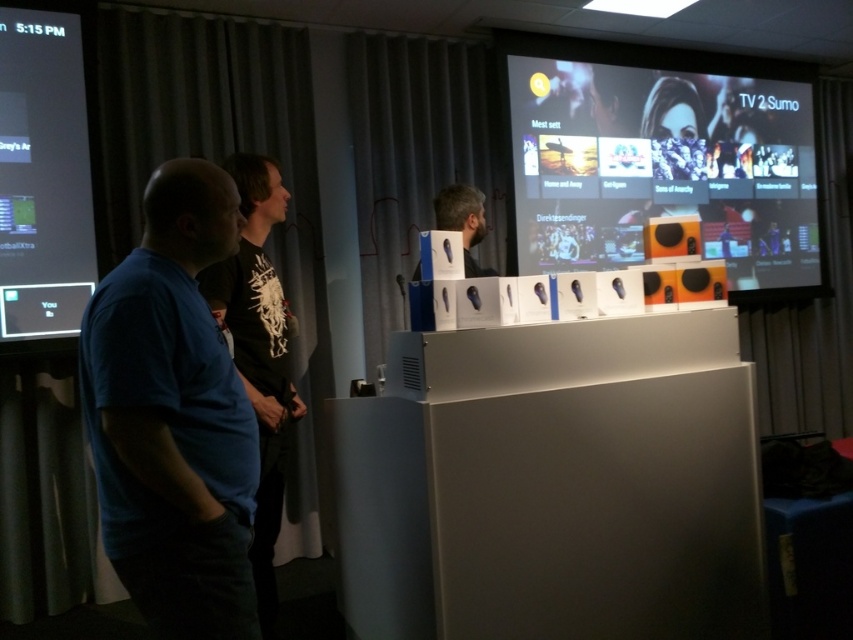
You are a technician who needs to adjust the distance between the display stand and the matte black screen at upper right to ensure optimal viewing. The recommended distance is 4 meters. Is the current distance sufficient?

The current distance between the display stand and the matte black screen at upper right is 3.81 meters, which is slightly less than the recommended 4 meters. Therefore, the current distance is not sufficient, and adjustment is needed to meet the optimal viewing requirement.

You are setting up a presentation and need to place a 3 feet wide banner between the two screens. Given the distance between the matte black screen at upper right and the matte black screen at left, will the banner fit without overlapping either screen?

The distance between the matte black screen at upper right and the matte black screen at left is 9.57 feet. Since the banner is 3 feet wide, there is sufficient space to place it between them without overlapping either screen as 9.57 feet is greater than 3 feet.